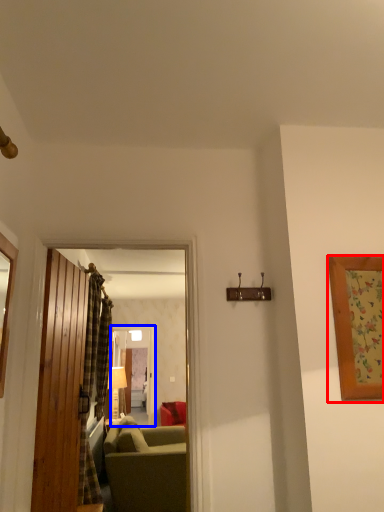
Question: Which object appears farthest to the camera in this image, picture frame (highlighted by a red box) or glass door (highlighted by a blue box)?

Choices:
 (A) picture frame
 (B) glass door

Answer: (B)